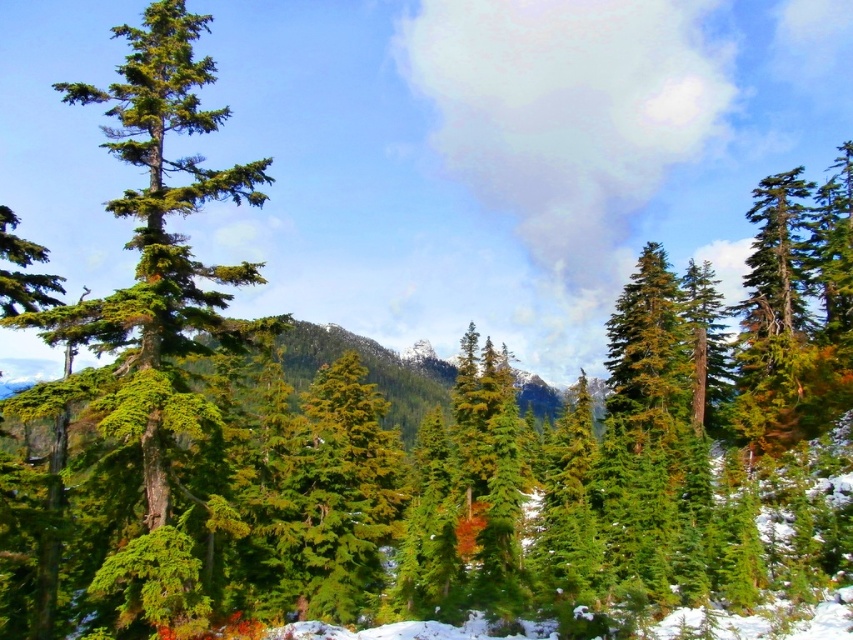
You are a hiker trying to navigate through the forest. You notice two trees ahead of you, the green textured evergreen tree at left and the green matte tree at center. Which tree has a wider trunk?

The green textured evergreen tree at left has a wider trunk than the green matte tree at center.

From the picture: You are a hiker trying to navigate through the forest. You see the green textured evergreen tree at left and the green matte tree at center. Which tree would block your view of the other tree if you are standing between them?

The green textured evergreen tree at left is in front of the green matte tree at center, so it would block your view of the green matte tree at center.

You are standing in the forest scene and want to walk from your current position to a specific location. If you move towards the point labeled as point (207, 292), will you pass by the point labeled as point (654, 268) before reaching your destination?

Since point (207, 292) is in front of point (654, 268), you will reach point (207, 292) before passing by point (654, 268). Therefore, you will not pass by point (654, 268) before arriving at your destination.